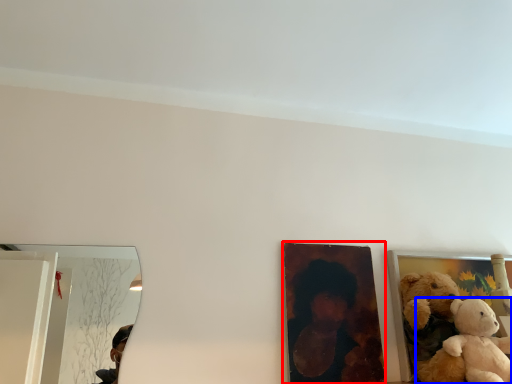
Question: Among these objects, which one is nearest to the camera, picture frame (highlighted by a red box) or teddy bear (highlighted by a blue box)?

Choices:
 (A) picture frame
 (B) teddy bear

Answer: (B)